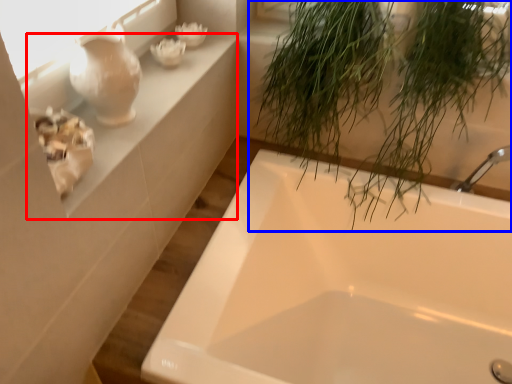
Question: Which object appears closest to the camera in this image, window sill (highlighted by a red box) or houseplant (highlighted by a blue box)?

Choices:
 (A) window sill
 (B) houseplant

Answer: (A)